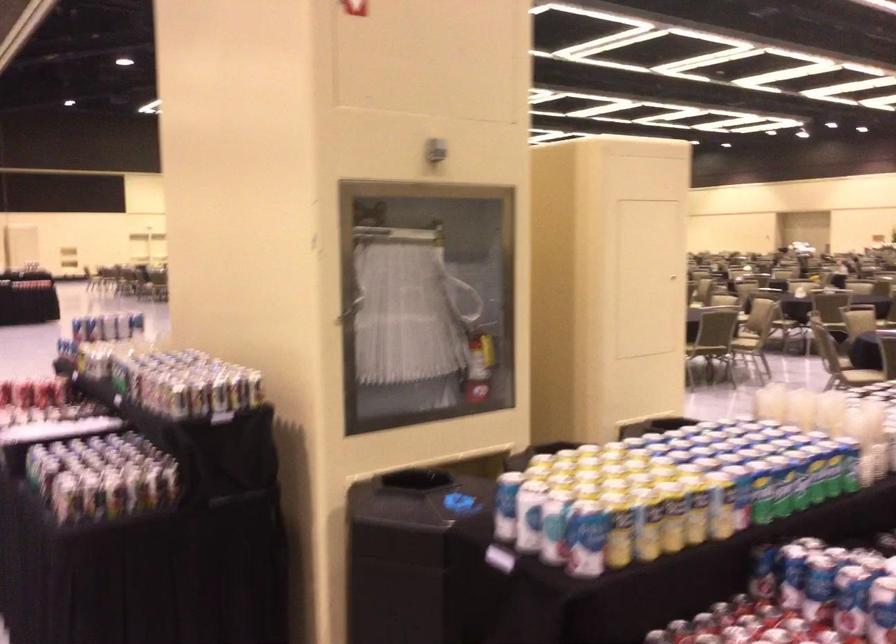
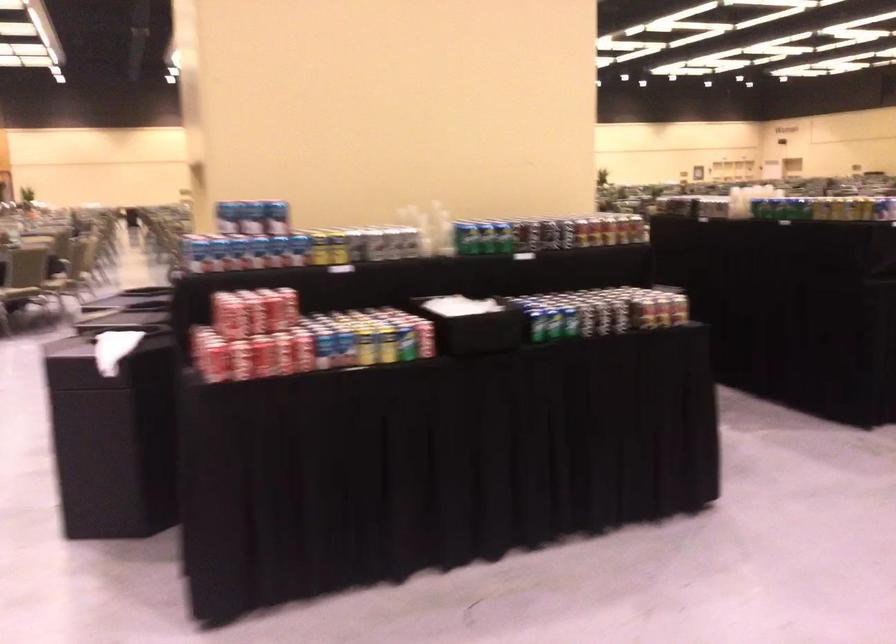
Question: I am providing you with two images of the same scene from different viewpoints. After the viewpoint changes to image2, which objects are now occluded?

Choices:
 (A) yellow soda can
 (B) dark blue armrest
 (C) blue soda can
 (D) red fire extinguisher

Answer: (D)